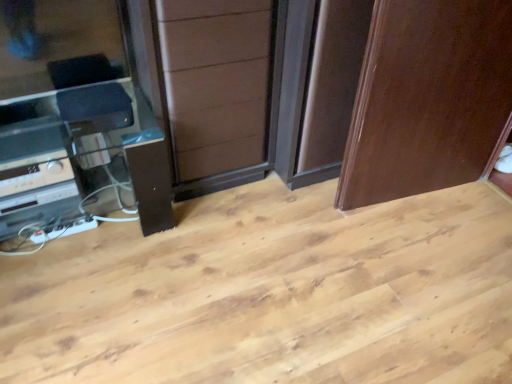
Question: From the image's perspective, relative to brown wood screen door at center, is glossy wood door at upper right above or below?

Choices:
 (A) below
 (B) above

Answer: (A)

Question: From a real-world perspective, is glossy wood door at upper right above or below brown wood screen door at center?

Choices:
 (A) below
 (B) above

Answer: (B)

Question: Considering the real-world distances, which object is farthest from the brown wood screen door at center?

Choices:
 (A) satin black entertainment center at left
 (B) glossy wood door at upper right
 (C) satin black stereo at lower left

Answer: (C)

Question: Considering the real-world distances, which object is farthest from the satin black stereo at lower left?

Choices:
 (A) brown wood screen door at center
 (B) satin black entertainment center at left
 (C) glossy wood door at upper right

Answer: (C)